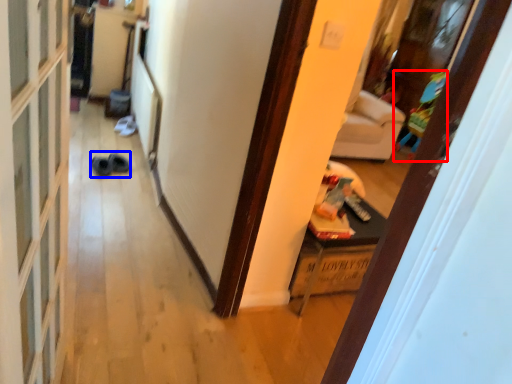
Question: Which object is closer to the camera taking this photo, toy (highlighted by a red box) or shoe (highlighted by a blue box)?

Choices:
 (A) toy
 (B) shoe

Answer: (B)